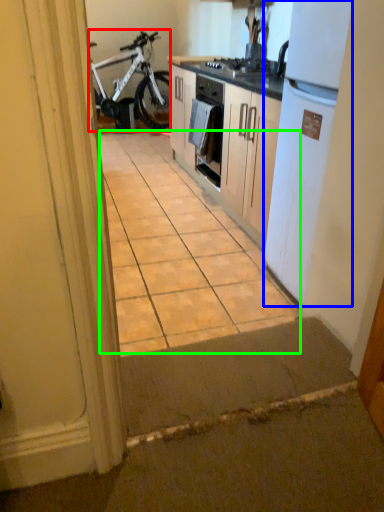
Question: Estimate the real-world distances between objects in this image. Which object is farther from bicycle (highlighted by a red box), refrigerator (highlighted by a blue box) or ceramic tile (highlighted by a green box)?

Choices:
 (A) refrigerator
 (B) ceramic tile

Answer: (A)